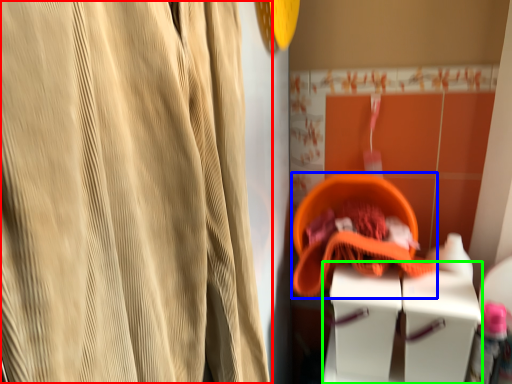
Question: Considering the real-world distances, which object is closest to curtain (highlighted by a red box)? basket (highlighted by a blue box) or vanity (highlighted by a green box).

Choices:
 (A) basket
 (B) vanity

Answer: (B)